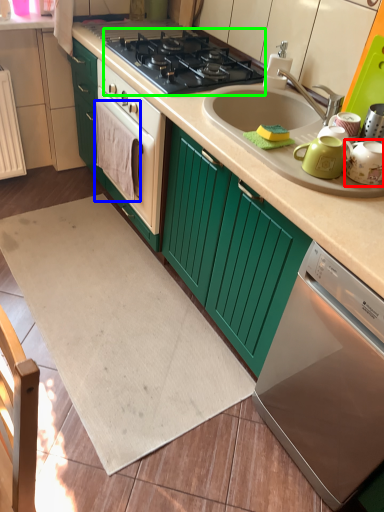
Question: Which is farther away from tea pot (highlighted by a red box)? blanket (highlighted by a blue box) or gas stove (highlighted by a green box)?

Choices:
 (A) blanket
 (B) gas stove

Answer: (A)